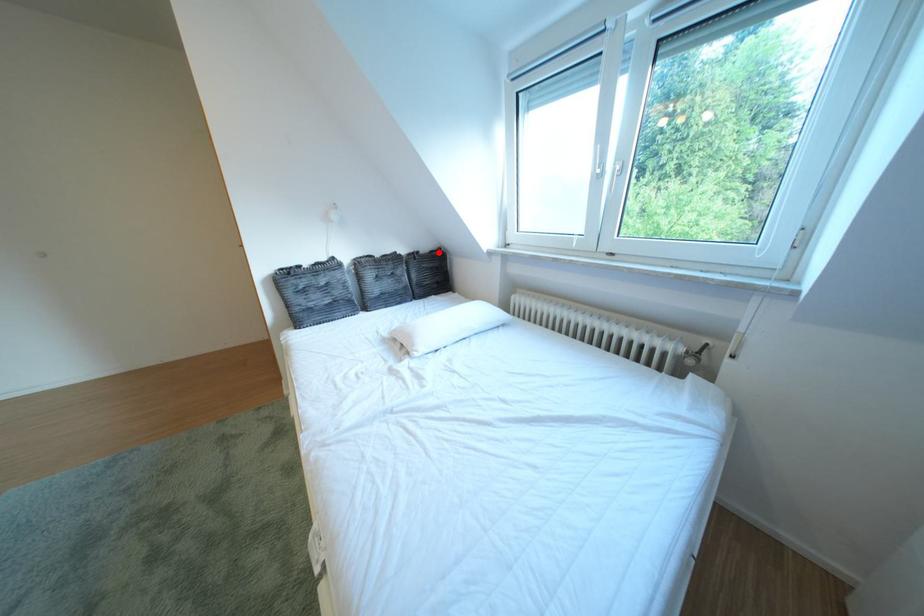
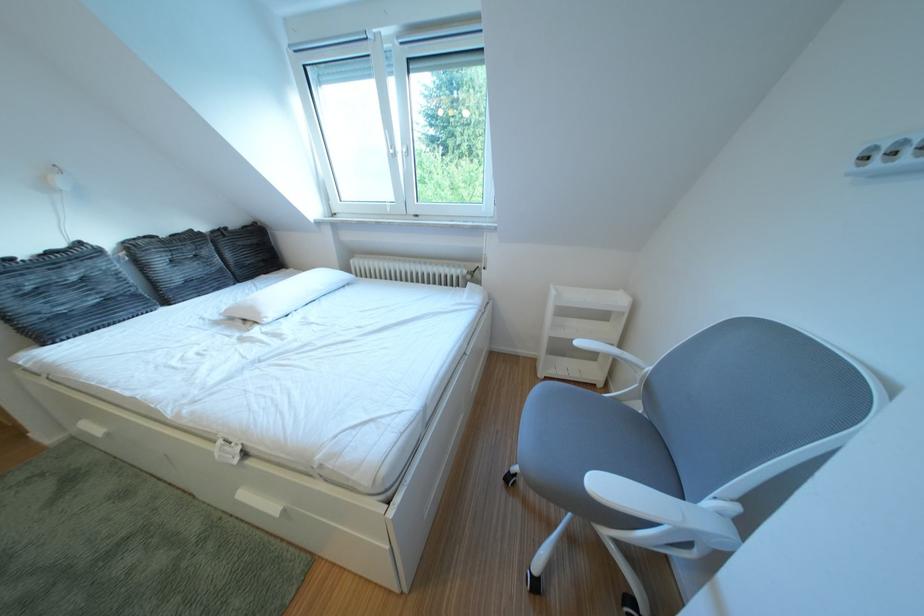
In the second image, find the point that corresponds to the highlighted location in the first image.

(247, 228)